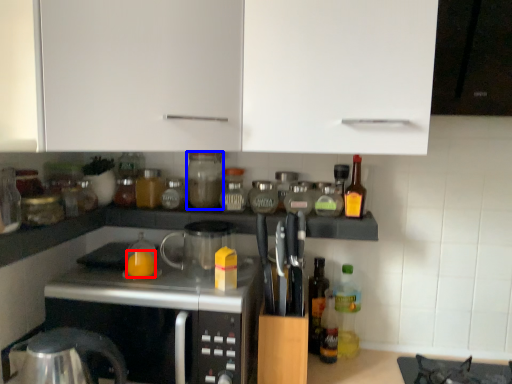
Question: Which object appears farthest to the camera in this image, orange juice (highlighted by a red box) or bottle (highlighted by a blue box)?

Choices:
 (A) orange juice
 (B) bottle

Answer: (B)